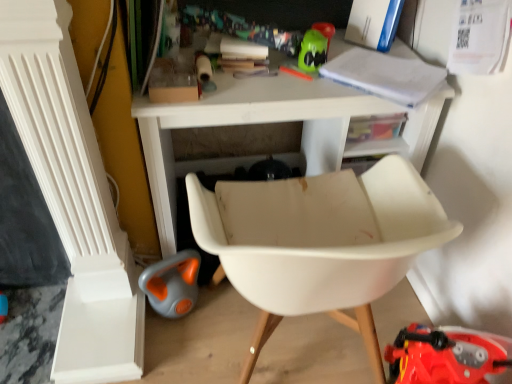
Question: Should I look upward or downward to see white matte table at upper center?

Choices:
 (A) up
 (B) down

Answer: (A)

Question: From the image's perspective, does white matte table at upper center appear higher than white plastic chair at center?

Choices:
 (A) yes
 (B) no

Answer: (A)

Question: From a real-world perspective, is white matte table at upper center positioned under white plastic chair at center based on gravity?

Choices:
 (A) no
 (B) yes

Answer: (B)

Question: Does white matte table at upper center appear on the right side of white plastic chair at center?

Choices:
 (A) yes
 (B) no

Answer: (B)

Question: Can you confirm if white matte table at upper center is wider than white plastic chair at center?

Choices:
 (A) yes
 (B) no

Answer: (B)

Question: Can you confirm if white matte table at upper center is shorter than white plastic chair at center?

Choices:
 (A) no
 (B) yes

Answer: (B)

Question: Is the position of white matte table at upper center more distant than that of white plastic chair at center?

Choices:
 (A) yes
 (B) no

Answer: (A)

Question: From a real-world perspective, does white plastic chair at center sit lower than white matte table at upper center?

Choices:
 (A) yes
 (B) no

Answer: (B)

Question: Is white plastic chair at center wider than white matte table at upper center?

Choices:
 (A) yes
 (B) no

Answer: (A)

Question: Is white matte table at upper center inside white plastic chair at center?

Choices:
 (A) no
 (B) yes

Answer: (A)

Question: Does white plastic chair at center lie behind white matte table at upper center?

Choices:
 (A) yes
 (B) no

Answer: (B)

Question: From a real-world perspective, is white plastic chair at center physically above white matte table at upper center?

Choices:
 (A) no
 (B) yes

Answer: (B)

Question: Is white plastic chair at center not within white matte table at upper center?

Choices:
 (A) no
 (B) yes

Answer: (B)

Question: Visually, is white plastic chair at center positioned to the left or to the right of white matte table at upper center?

Choices:
 (A) left
 (B) right

Answer: (B)